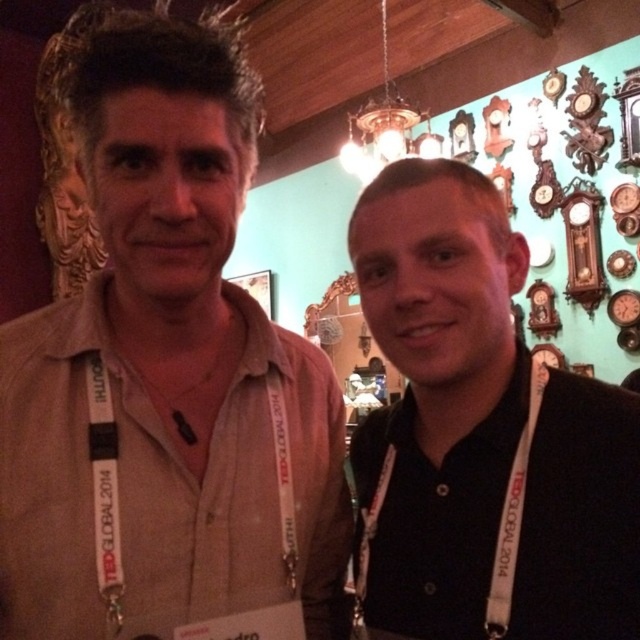
Question: Which point is farther to the camera?

Choices:
 (A) black matte shirt at right
 (B) beige cotton shirt at center
 (C) white fabric lanyard at right

Answer: (C)

Question: Observing the image, what is the correct spatial positioning of beige cotton shirt at center in reference to white fabric lanyard at right?

Choices:
 (A) right
 (B) left

Answer: (B)

Question: Which point appears closest to the camera in this image?

Choices:
 (A) (209, 476)
 (B) (582, 468)
 (C) (534, 378)

Answer: (B)

Question: Can you confirm if black matte shirt at right is positioned to the left of white fabric lanyard at right?

Choices:
 (A) no
 (B) yes

Answer: (A)

Question: Which object is closer to the camera taking this photo?

Choices:
 (A) white fabric lanyard at right
 (B) beige cotton shirt at center

Answer: (B)

Question: Can you confirm if beige cotton shirt at center is positioned above black matte shirt at right?

Choices:
 (A) yes
 (B) no

Answer: (A)